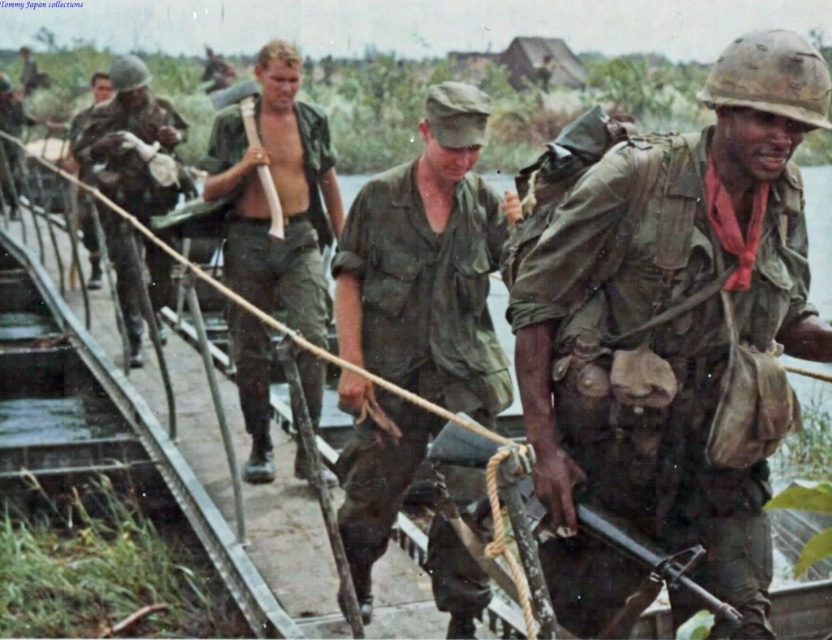
How much distance is there between green matte uniform at center and matte green helmet at left?

green matte uniform at center is 7.18 meters from matte green helmet at left.

Between point (358, 520) and point (83, 177), which one is positioned behind?

Positioned behind is point (83, 177).

Does point (369, 324) come farther from viewer compared to point (68, 124)?

No, (369, 324) is in front of (68, 124).

Where is `green matte uniform at center`? green matte uniform at center is located at coordinates (428, 266).

Who is positioned more to the left, camouflage fabric helmet at center or matte green helmet at left?

From the viewer's perspective, matte green helmet at left appears more on the left side.

Is camouflage fabric helmet at center thinner than matte green helmet at left?

Yes, camouflage fabric helmet at center is thinner than matte green helmet at left.

The image size is (832, 640). I want to click on camouflage fabric helmet at center, so click(x=674, y=316).

Does matte black rifle at center have a larger size compared to matte green helmet at left?

No, matte black rifle at center is not bigger than matte green helmet at left.

Which is below, matte black rifle at center or matte green helmet at left?

matte black rifle at center is below.

Is point (637, 544) in front of point (97, 90)?

Yes, it is in front of point (97, 90).

This screenshot has height=640, width=832. Identify the location of matte black rifle at center. (657, 561).